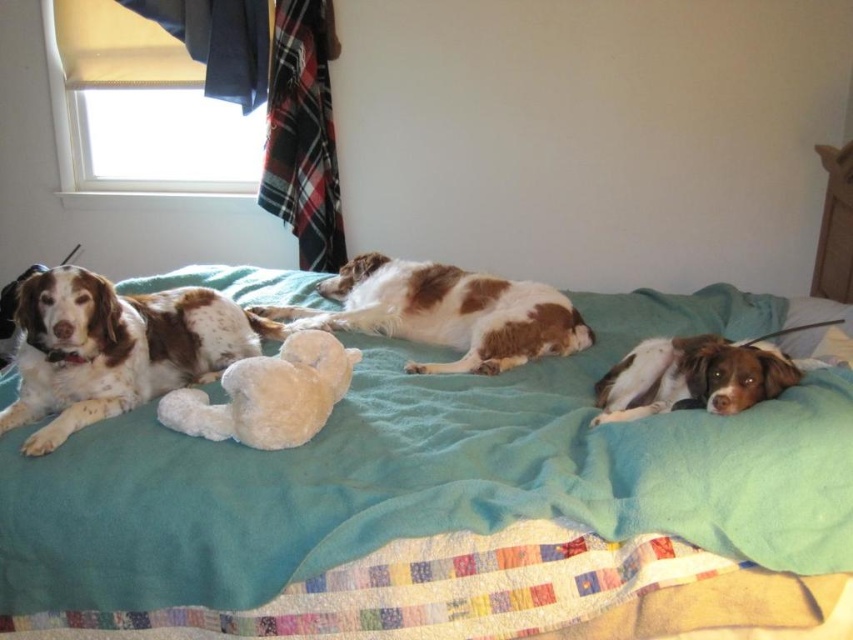
Does point (782, 312) come behind point (733, 371)?

Yes, point (782, 312) is farther from viewer.

This screenshot has width=853, height=640. What do you see at coordinates (434, 499) in the screenshot?
I see `teal soft blanket at center` at bounding box center [434, 499].

Is point (625, 314) positioned behind point (610, 406)?

Yes, point (625, 314) is behind point (610, 406).

You are a GUI agent. You are given a task and a screenshot of the screen. Output one action in this format:
    pyautogui.click(x=<x>, y=<y>)
    Task: Click on the teal soft blanket at center
    
    Given the screenshot: What is the action you would take?
    [434, 499]

Can you confirm if white fluffy teddy bear at center is smaller than brown and white fur at lower right?

No, white fluffy teddy bear at center is not smaller than brown and white fur at lower right.

At what (x,y) coordinates should I click in order to perform the action: click on white fluffy teddy bear at center. Please return your answer as a coordinate pair (x, y). Image resolution: width=853 pixels, height=640 pixels. Looking at the image, I should click on (268, 394).

In the scene shown: Who is higher up, speckled white fur dog at left or white fluffy pillow at lower right?

speckled white fur dog at left is above.

Is point (28, 372) farther from camera compared to point (807, 317)?

No, (28, 372) is closer to viewer.

Image resolution: width=853 pixels, height=640 pixels. Identify the location of speckled white fur dog at left. (113, 348).

The width and height of the screenshot is (853, 640). In order to click on speckled white fur dog at left in this screenshot , I will do `click(113, 348)`.